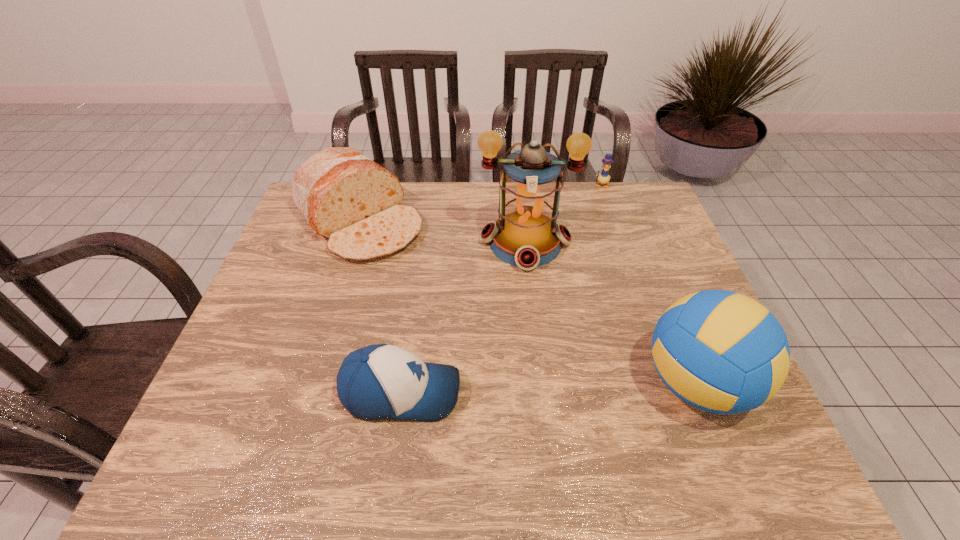
I want to click on vacant space on the desktop that is between the baseball cap and the volleyball and is positioned on the front-facing side of the tallest object, so click(529, 388).

At what (x,y) coordinates should I click in order to perform the action: click on vacant spot on the desktop that is between the baseball cap and the volleyball and is positioned at the sliced end of the third shortest object. Please return your answer as a coordinate pair (x, y). This screenshot has width=960, height=540. Looking at the image, I should click on (537, 388).

You are a GUI agent. You are given a task and a screenshot of the screen. Output one action in this format:
    pyautogui.click(x=<x>, y=<y>)
    Task: Click on the vacant space on the desktop that is between the baseball cap and the second tallest object and is positioned on the face of the duckling, where the monocle is placed
    
    Given the screenshot: What is the action you would take?
    click(591, 387)